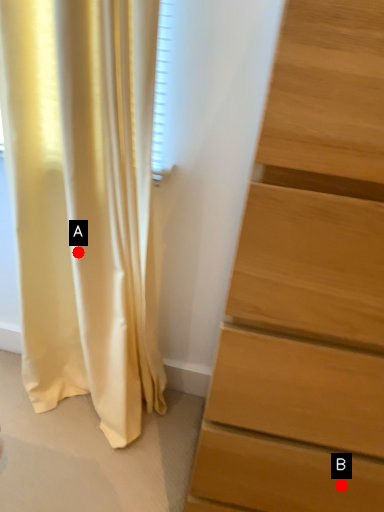
Question: Two points are circled on the image, labeled by A and B beside each circle. Which point appears farthest from the camera in this image?

Choices:
 (A) A is further
 (B) B is further

Answer: (A)